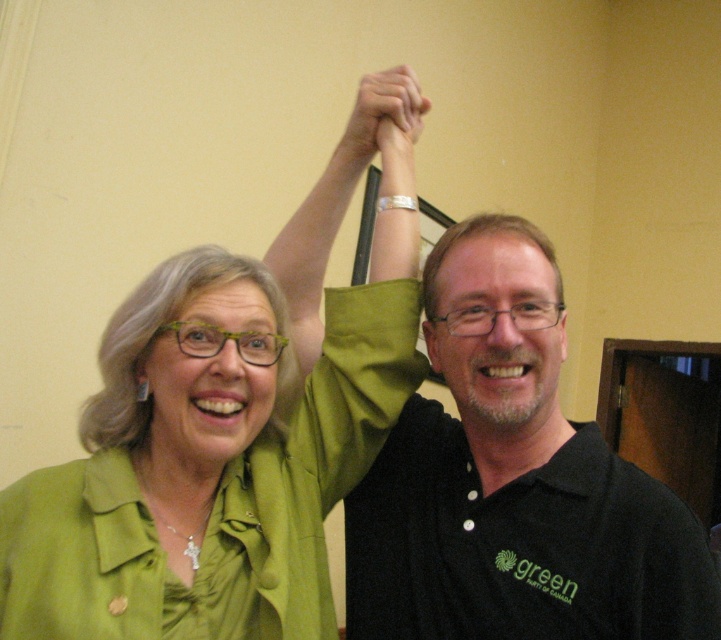
Is green matte arm at upper center further to camera compared to matte green hand at center?

No, green matte arm at upper center is in front of matte green hand at center.

Between green matte arm at upper center and matte green hand at center, which one appears on the right side from the viewer's perspective?

Positioned to the right is matte green hand at center.

Is point (286, 240) closer to camera compared to point (337, 152)?

No.

The width and height of the screenshot is (721, 640). In order to click on green matte arm at upper center in this screenshot , I will do `click(336, 200)`.

Consider the image. Does black matte shirt at upper right lie in front of matte green hand at center?

Yes, it is.

Is black matte shirt at upper right above matte green hand at center?

No.

Who is more forward, (684, 636) or (407, 77)?

Positioned in front is point (684, 636).

Find the location of a particular element. black matte shirt at upper right is located at coordinates (513, 481).

Can you confirm if green matte jacket at upper left is taller than green matte arm at upper center?

Correct, green matte jacket at upper left is much taller as green matte arm at upper center.

Describe the element at coordinates (211, 474) in the screenshot. I see `green matte jacket at upper left` at that location.

Is point (208, 554) farther from viewer compared to point (314, 344)?

No, it is not.

Where is `green matte jacket at upper left`? The width and height of the screenshot is (721, 640). green matte jacket at upper left is located at coordinates (211, 474).